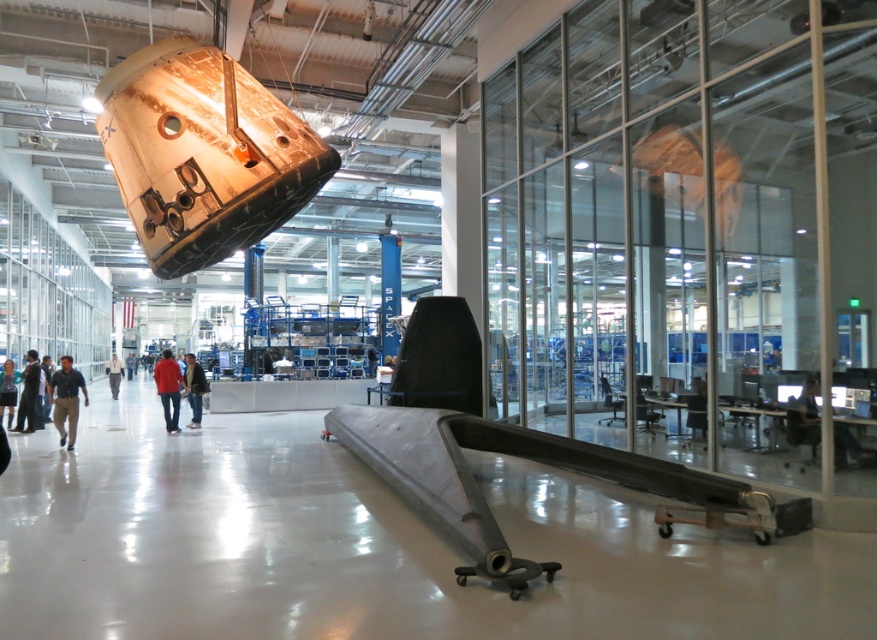
Is black glossy computer at lower right bigger than matte black jacket at center?

Incorrect, black glossy computer at lower right is not larger than matte black jacket at center.

Can you confirm if black glossy computer at lower right is smaller than matte black jacket at center?

Indeed, black glossy computer at lower right has a smaller size compared to matte black jacket at center.

Does point (846, 452) lie in front of point (203, 381)?

Yes.

Image resolution: width=877 pixels, height=640 pixels. Identify the location of black glossy computer at lower right. (804, 413).

This screenshot has height=640, width=877. What do you see at coordinates (29, 394) in the screenshot?
I see `dark blue jeans at lower left` at bounding box center [29, 394].

Which is in front, point (27, 388) or point (198, 387)?

Point (27, 388) is in front.

I want to click on dark blue jeans at lower left, so click(x=29, y=394).

Can you confirm if dark blue jeans at lower left is shorter than blue denim jacket at lower left?

In fact, dark blue jeans at lower left may be taller than blue denim jacket at lower left.

Is dark blue jeans at lower left positioned in front of blue denim jacket at lower left?

No, it is not.

Locate an element on the screen. This screenshot has width=877, height=640. dark blue jeans at lower left is located at coordinates (29, 394).

At what (x,y) coordinates should I click in order to perform the action: click on dark blue jeans at lower left. Please return your answer as a coordinate pair (x, y). The width and height of the screenshot is (877, 640). Looking at the image, I should click on (29, 394).